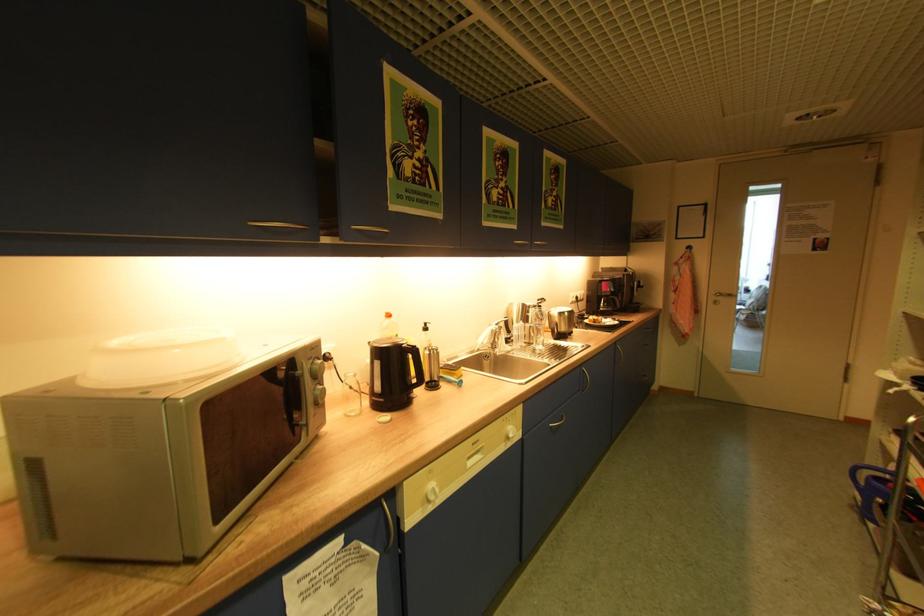
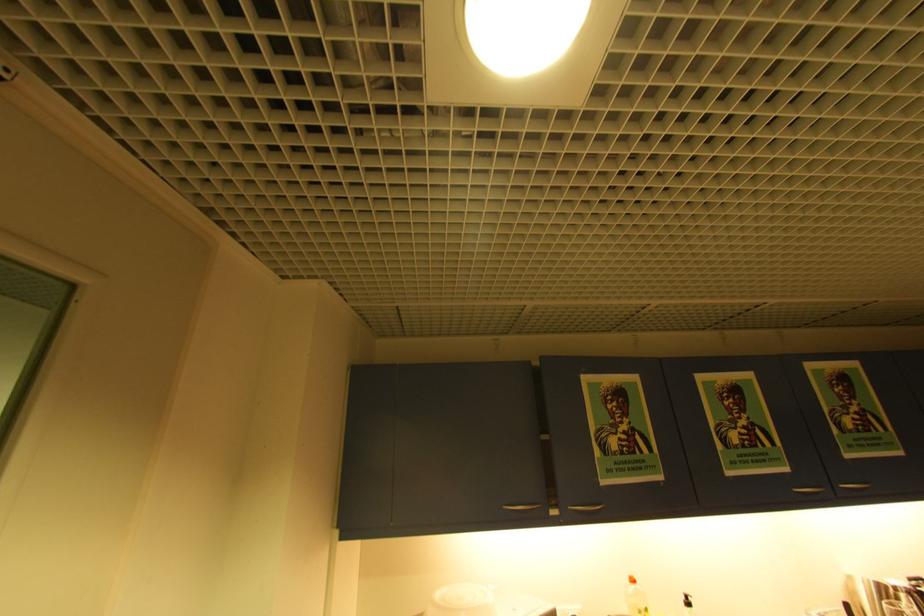
In the second image, find the point that corresponds to the point at 432,330 in the first image.

(695, 605)